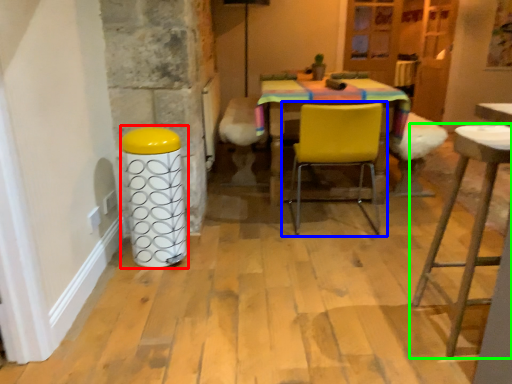
Question: Which object is positioned farthest from bar stool (highlighted by a red box)? Select from chair (highlighted by a blue box) and stool (highlighted by a green box).

Choices:
 (A) chair
 (B) stool

Answer: (B)